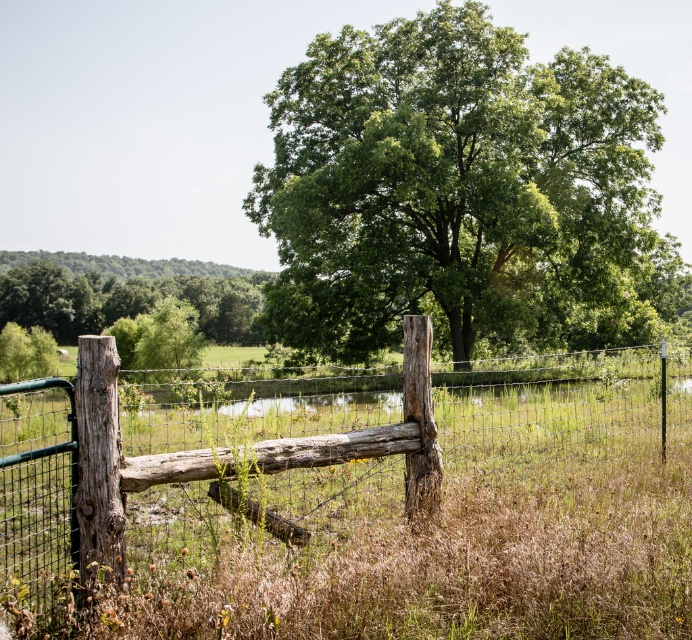
Identify the location of weathered wood fence at left. (356, 504).

Between weathered wood fence at left and green leafy tree at center, which one appears on the left side from the viewer's perspective?

Positioned to the left is weathered wood fence at left.

Which is in front, point (518, 369) or point (572, 134)?

Point (518, 369)

This screenshot has width=692, height=640. What are the coordinates of `weathered wood fence at left` in the screenshot? It's located at (356, 504).

Between weathered wood fence at left and green leafy tree at upper center, which one has more height?

Standing taller between the two is green leafy tree at upper center.

Does weathered wood fence at left appear on the right side of green leafy tree at upper center?

Yes, weathered wood fence at left is to the right of green leafy tree at upper center.

The height and width of the screenshot is (640, 692). Find the location of `weathered wood fence at left`. weathered wood fence at left is located at coordinates (356, 504).

Is green leafy tree at center further to camera compared to green leafy tree at upper center?

No, green leafy tree at center is in front of green leafy tree at upper center.

In the scene shown: Can you confirm if green leafy tree at center is thinner than green leafy tree at upper center?

Indeed, green leafy tree at center has a lesser width compared to green leafy tree at upper center.

The height and width of the screenshot is (640, 692). In order to click on green leafy tree at center in this screenshot , I will do `click(459, 192)`.